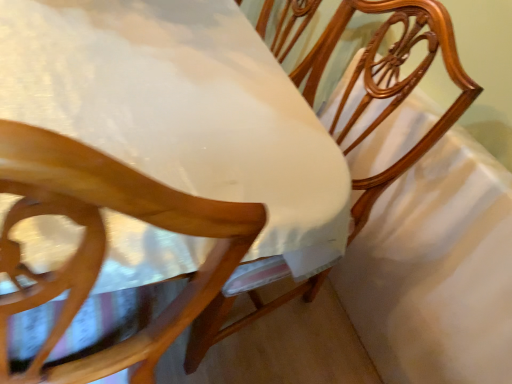
Question: Considering the relative positions of white glossy table at center and white satin sheet at center in the image provided, is white glossy table at center in front of white satin sheet at center?

Choices:
 (A) yes
 (B) no

Answer: (A)

Question: Considering the relative sizes of white glossy table at center and white satin sheet at center in the image provided, is white glossy table at center thinner than white satin sheet at center?

Choices:
 (A) no
 (B) yes

Answer: (A)

Question: Is white glossy table at center bigger than white satin sheet at center?

Choices:
 (A) no
 (B) yes

Answer: (B)

Question: Can you confirm if white glossy table at center is positioned to the left of white satin sheet at center?

Choices:
 (A) yes
 (B) no

Answer: (A)

Question: Is white glossy table at center smaller than white satin sheet at center?

Choices:
 (A) yes
 (B) no

Answer: (B)

Question: From a real-world perspective, is white satin sheet at center above or below wooden chair at center?

Choices:
 (A) above
 (B) below

Answer: (B)

Question: Based on their positions, is white satin sheet at center located to the left or right of wooden chair at center?

Choices:
 (A) right
 (B) left

Answer: (A)

Question: Is white satin sheet at center wider or thinner than wooden chair at center?

Choices:
 (A) thin
 (B) wide

Answer: (A)

Question: Is white satin sheet at center inside the boundaries of wooden chair at center, or outside?

Choices:
 (A) inside
 (B) outside

Answer: (B)

Question: In the image, is white glossy table at center on the left side or the right side of white satin sheet at center?

Choices:
 (A) left
 (B) right

Answer: (A)

Question: From a real-world perspective, is white glossy table at center positioned above or below white satin sheet at center?

Choices:
 (A) above
 (B) below

Answer: (A)

Question: Does point (72, 223) appear closer or farther from the camera than point (419, 339)?

Choices:
 (A) farther
 (B) closer

Answer: (B)

Question: From the image's perspective, is white glossy table at center above or below white satin sheet at center?

Choices:
 (A) above
 (B) below

Answer: (A)

Question: From the image's perspective, is wooden chair at center located above or below white glossy table at center?

Choices:
 (A) below
 (B) above

Answer: (B)

Question: Is wooden chair at center taller or shorter than white glossy table at center?

Choices:
 (A) tall
 (B) short

Answer: (B)